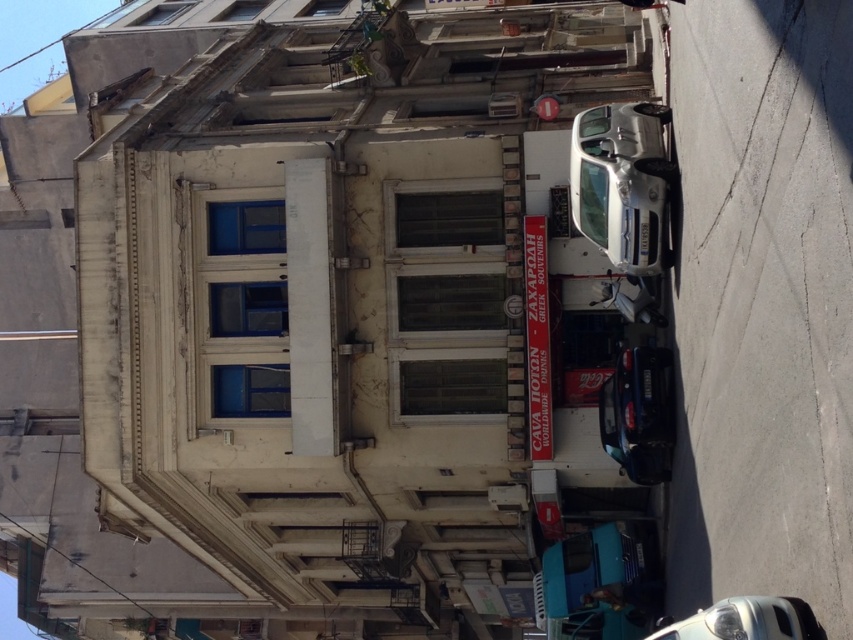
You are a tourist standing on the sidewalk in front of the building. You see a silver metallic car at right and a shiny blue car at center. Which car is closer to the building?

The silver metallic car at right is positioned on the left side of the shiny blue car at center, so the shiny blue car at center is closer to the building than the silver metallic car at right.

You are standing on the sidewalk in front of the building and want to take a photo of the red signboard. The camera you are using has a maximum focus range of 150 feet. Will you be able to focus on the point at point (560, 595)?

The point at point (560, 595) is 182.46 feet away from the viewer. Since the camera can only focus up to 150 feet, it will not be able to focus on the point at point (560, 595).